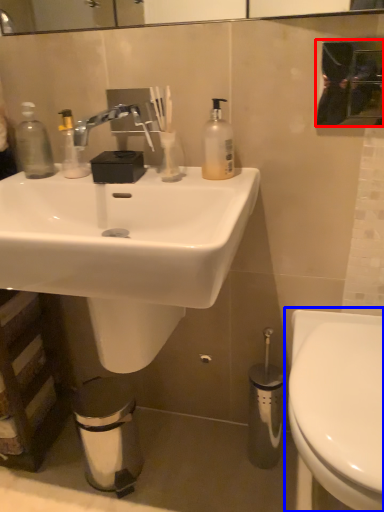
Question: Which point is closer to the camera, mirror (highlighted by a red box) or toilet (highlighted by a blue box)?

Choices:
 (A) mirror
 (B) toilet

Answer: (B)